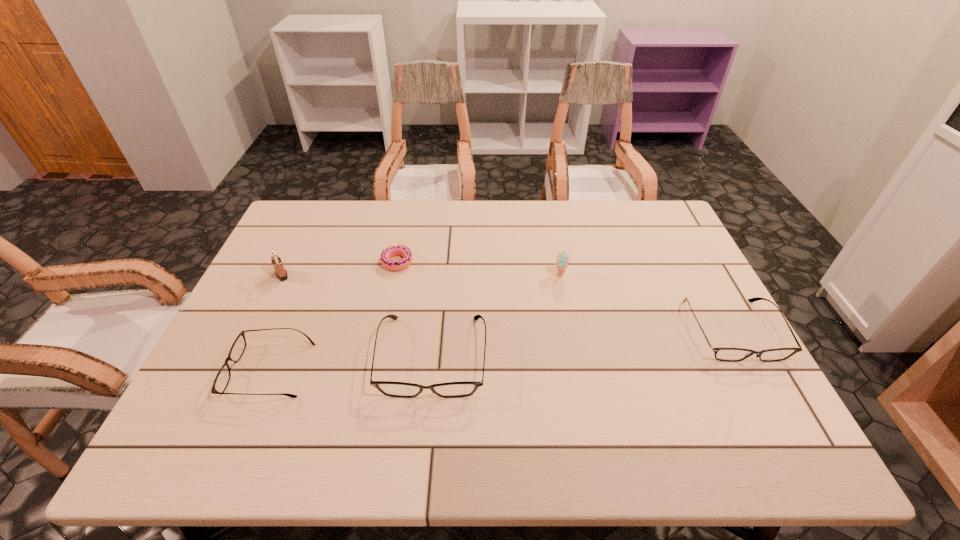
At what (x,y) coordinates should I click in order to perform the action: click on the second shortest object. Please return your answer as a coordinate pair (x, y). The image size is (960, 540). Looking at the image, I should click on (222, 379).

The image size is (960, 540). I want to click on the leftmost spectacles, so click(222, 379).

This screenshot has height=540, width=960. Find the location of `the second spectacles from left to right`. the second spectacles from left to right is located at coordinates (389, 388).

The height and width of the screenshot is (540, 960). Identify the location of the fourth tallest object. (726, 354).

Where is `the rightmost object`? The height and width of the screenshot is (540, 960). the rightmost object is located at coordinates (726, 354).

The width and height of the screenshot is (960, 540). Identify the location of the second object from right to left. (562, 260).

In order to click on the shortest object in this screenshot , I will do `click(399, 250)`.

Image resolution: width=960 pixels, height=540 pixels. I want to click on padlock, so click(x=281, y=273).

This screenshot has height=540, width=960. What are the coordinates of `free space located on the front of the sherbert` in the screenshot? It's located at (570, 324).

Image resolution: width=960 pixels, height=540 pixels. I want to click on free space located on the front of the doughnut, so click(376, 363).